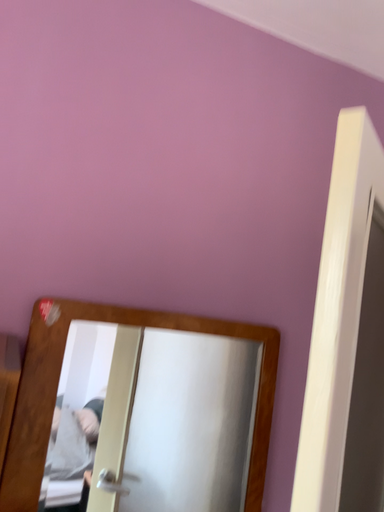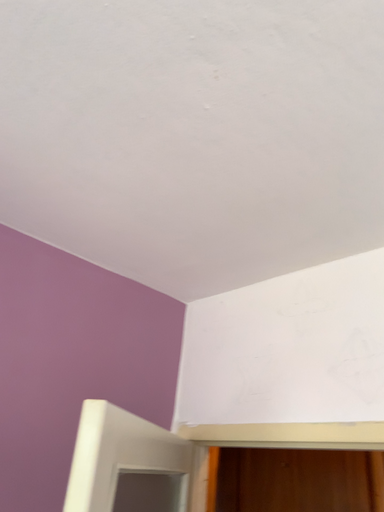
Question: How did the camera likely rotate when shooting the video?

Choices:
 (A) rotated left
 (B) rotated right

Answer: (B)